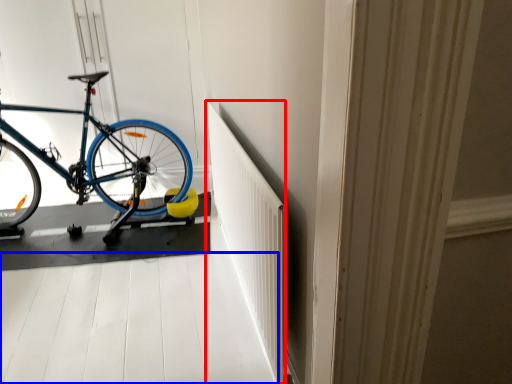
Question: Which point is closer to the camera, radiator (highlighted by a red box) or path (highlighted by a blue box)?

Choices:
 (A) radiator
 (B) path

Answer: (A)